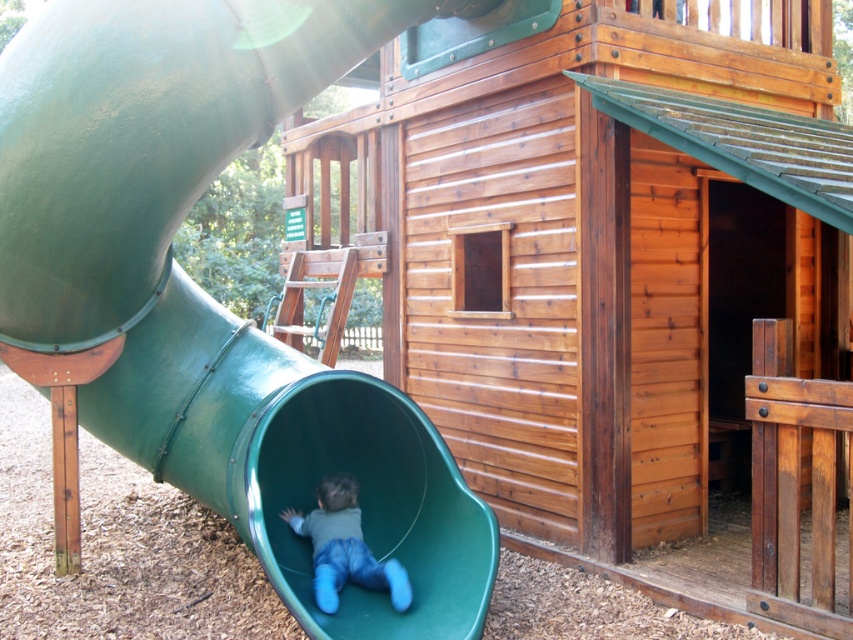
Question: Can you confirm if wooden cabin at center is positioned to the right of green rubber slide at left?

Choices:
 (A) no
 (B) yes

Answer: (B)

Question: Based on their relative distances, which object is nearer to the wooden cabin at center?

Choices:
 (A) green rubber slide at left
 (B) matte green slide at lower left

Answer: (A)

Question: Among these points, which one is nearest to the camera?

Choices:
 (A) (317, 150)
 (B) (422, 625)
 (C) (364, 564)

Answer: (B)

Question: Does green rubber slide at left appear under matte green slide at lower left?

Choices:
 (A) yes
 (B) no

Answer: (B)

Question: Is wooden cabin at center bigger than green rubber slide at left?

Choices:
 (A) no
 (B) yes

Answer: (B)

Question: Which point is farther to the camera?

Choices:
 (A) wooden cabin at center
 (B) matte green slide at lower left
 (C) green rubber slide at left

Answer: (A)